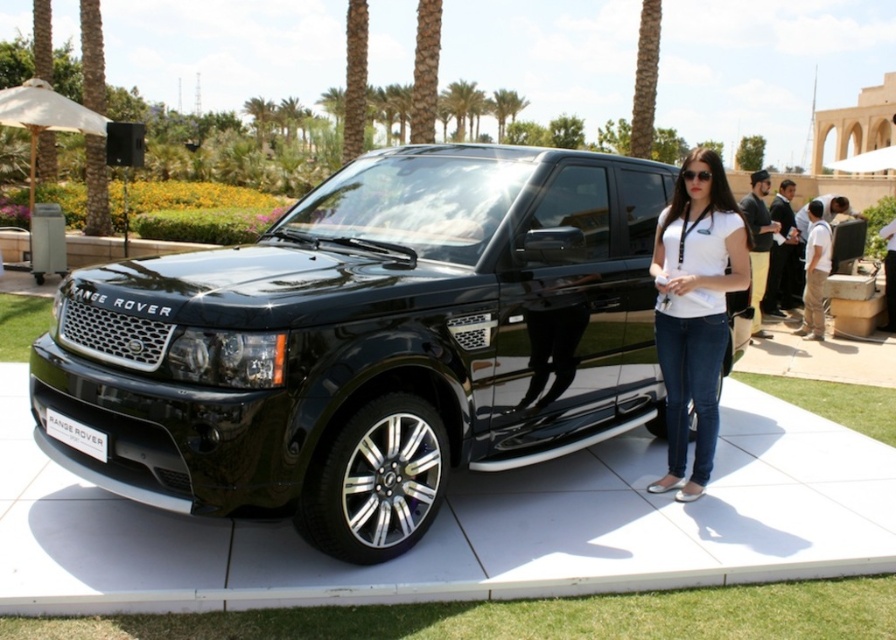
Question: Which point is closer to the camera?

Choices:
 (A) (350, 385)
 (B) (678, 416)

Answer: (A)

Question: Is black metallic car at center wider than white matte shirt at center?

Choices:
 (A) yes
 (B) no

Answer: (A)

Question: Does black metallic car at center have a smaller size compared to white matte shirt at center?

Choices:
 (A) no
 (B) yes

Answer: (A)

Question: Among these points, which one is farthest from the camera?

Choices:
 (A) (627, 340)
 (B) (686, 412)

Answer: (A)

Question: Does black metallic car at center appear on the left side of white matte shirt at center?

Choices:
 (A) no
 (B) yes

Answer: (B)